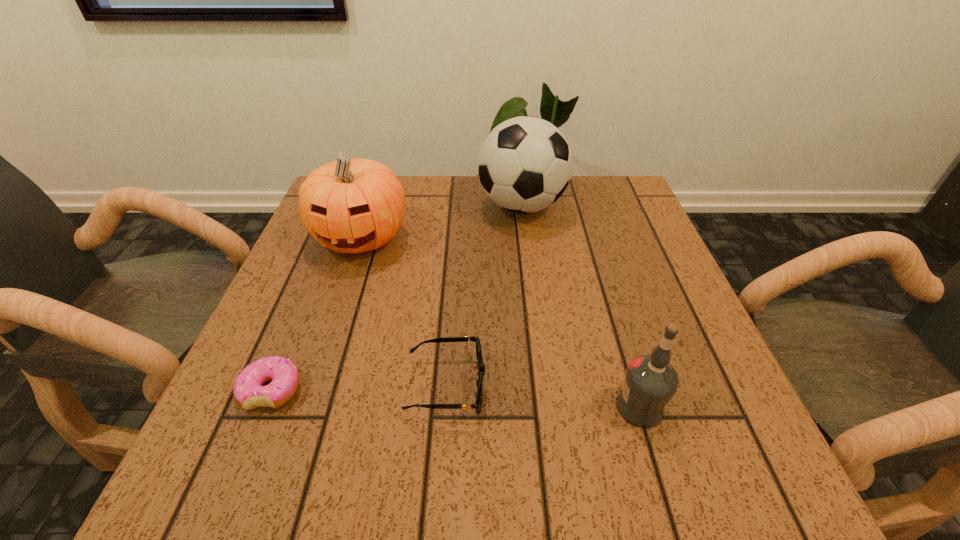
In order to click on soccer ball in this screenshot , I will do `click(524, 165)`.

You are a GUI agent. You are given a task and a screenshot of the screen. Output one action in this format:
    pyautogui.click(x=<x>, y=<y>)
    Task: Click on the pumpkin
    The width and height of the screenshot is (960, 540).
    Given the screenshot: What is the action you would take?
    pyautogui.click(x=352, y=205)

The image size is (960, 540). What are the coordinates of `vodka` in the screenshot? It's located at (650, 382).

Find the location of a particular element. sunglasses is located at coordinates (477, 406).

Where is `doughnut`? The width and height of the screenshot is (960, 540). doughnut is located at coordinates (249, 393).

In order to click on free space located on the right of the soccer ball in this screenshot , I will do `click(622, 206)`.

Identify the location of vacant area situated 0.300m on the front-facing side of the pumpkin. The width and height of the screenshot is (960, 540). (312, 383).

The width and height of the screenshot is (960, 540). I want to click on free region located on the front label of the vodka, so click(x=384, y=407).

Image resolution: width=960 pixels, height=540 pixels. What are the coordinates of `vacant space situated on the front label of the vodka` in the screenshot? It's located at (567, 407).

Find the location of `vacant space located 0.080m on the front label of the vodka`. vacant space located 0.080m on the front label of the vodka is located at coordinates (567, 407).